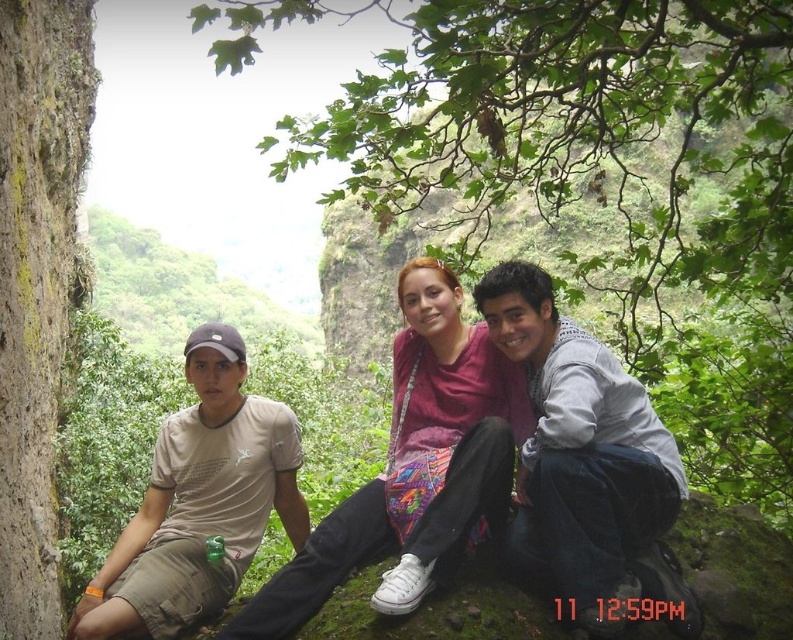
What do you see at coordinates (592, 168) in the screenshot? The height and width of the screenshot is (640, 793). I see `green leafy tree at center` at bounding box center [592, 168].

Does point (474, 45) come closer to viewer compared to point (400, 417)?

That is True.

You are a GUI agent. You are given a task and a screenshot of the screen. Output one action in this format:
    pyautogui.click(x=<x>, y=<y>)
    Task: Click on the green leafy tree at center
    This screenshot has width=793, height=640.
    Given the screenshot: What is the action you would take?
    pyautogui.click(x=592, y=168)

Can you confirm if matte pink shirt at center is smaller than beige cotton t-shirt at left?

Yes, matte pink shirt at center is smaller than beige cotton t-shirt at left.

Does point (485, 520) come farther from viewer compared to point (119, 620)?

Yes, point (485, 520) is behind point (119, 620).

The width and height of the screenshot is (793, 640). Describe the element at coordinates (412, 467) in the screenshot. I see `matte pink shirt at center` at that location.

In order to click on matte pink shirt at center in this screenshot , I will do `click(412, 467)`.

Which is below, matte pink shirt at center or matte pink sweater at center?

matte pink shirt at center

Is point (389, 502) behind point (397, 392)?

That is False.

Who is more forward, (500, 486) or (487, 403)?

Point (500, 486) is more forward.

You are a GUI agent. You are given a task and a screenshot of the screen. Output one action in this format:
    pyautogui.click(x=<x>, y=<y>)
    Task: Click on the matte pink shirt at center
    
    Given the screenshot: What is the action you would take?
    pyautogui.click(x=412, y=467)